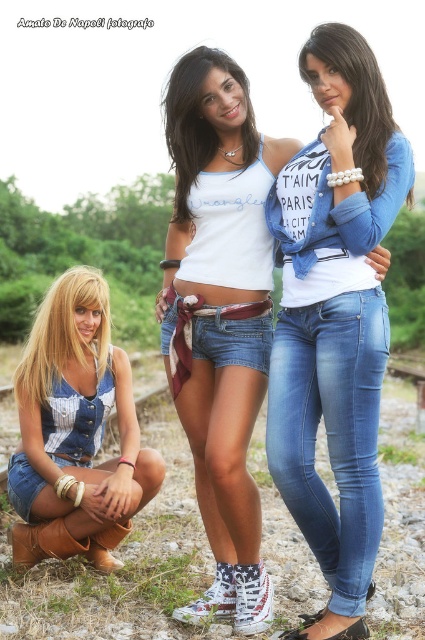
Does denim jeans at center appear on the left side of denim shorts at lower left?

Incorrect, denim jeans at center is not on the left side of denim shorts at lower left.

Which is in front, point (354, 576) or point (107, 564)?

Positioned in front is point (354, 576).

Image resolution: width=425 pixels, height=640 pixels. In order to click on denim jeans at center in this screenshot , I will do `click(334, 320)`.

This screenshot has width=425, height=640. What do you see at coordinates (76, 432) in the screenshot?
I see `denim shorts at lower left` at bounding box center [76, 432].

Who is more forward, [102,493] or [359,563]?

Point [359,563] is more forward.

Identify the location of denim shorts at lower left. This screenshot has width=425, height=640. (76, 432).

Is denim jeans at center wider than blue denim jeans at center?

Indeed, denim jeans at center has a greater width compared to blue denim jeans at center.

You are a GUI agent. You are given a task and a screenshot of the screen. Output one action in this format:
    pyautogui.click(x=<x>, y=<y>)
    Task: Click on the denim jeans at center
    This screenshot has height=640, width=425.
    Given the screenshot: What is the action you would take?
    pyautogui.click(x=334, y=320)